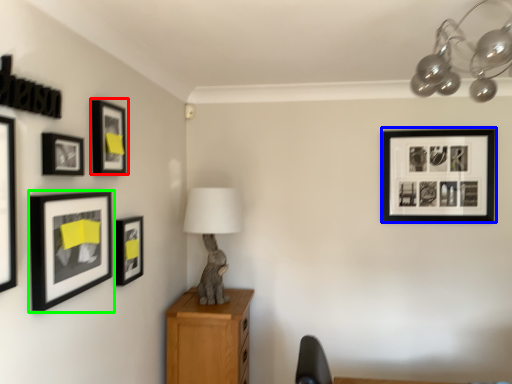
Question: Which object is positioned farthest from picture frame (highlighted by a red box)? Select from picture frame (highlighted by a blue box) and picture frame (highlighted by a green box).

Choices:
 (A) picture frame
 (B) picture frame

Answer: (A)